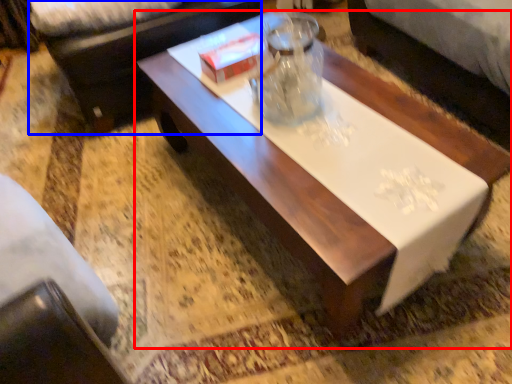
Question: Which object appears farthest to the camera in this image, coffee table (highlighted by a red box) or couch (highlighted by a blue box)?

Choices:
 (A) coffee table
 (B) couch

Answer: (B)